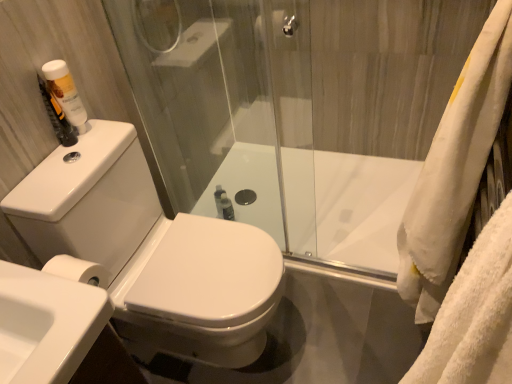
Locate an element on the screen. vacant space that is to the left of transparent glass shower door at upper right is located at coordinates (298, 301).